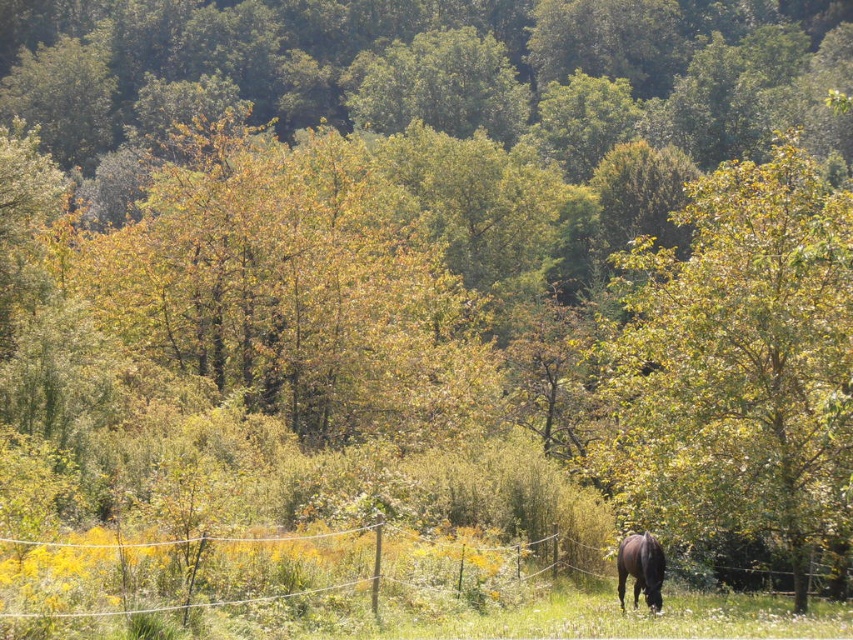
Question: Estimate the real-world distances between objects in this image. Which object is closer to the black glossy horse at lower right?

Choices:
 (A) wire mesh at lower right
 (B) green leafy tree at center

Answer: (A)

Question: Is green leafy tree at center to the left of wire mesh at lower right from the viewer's perspective?

Choices:
 (A) yes
 (B) no

Answer: (B)

Question: Among these points, which one is nearest to the camera?

Choices:
 (A) (653, 499)
 (B) (653, 554)
 (C) (517, 563)

Answer: (B)

Question: Where is wire mesh at lower right located in relation to black glossy horse at lower right in the image?

Choices:
 (A) right
 (B) left

Answer: (B)

Question: Which object is closer to the camera taking this photo?

Choices:
 (A) wire mesh at lower right
 (B) green leafy tree at center
 (C) black glossy horse at lower right

Answer: (A)

Question: Can you confirm if green leafy tree at center is thinner than black glossy horse at lower right?

Choices:
 (A) yes
 (B) no

Answer: (B)